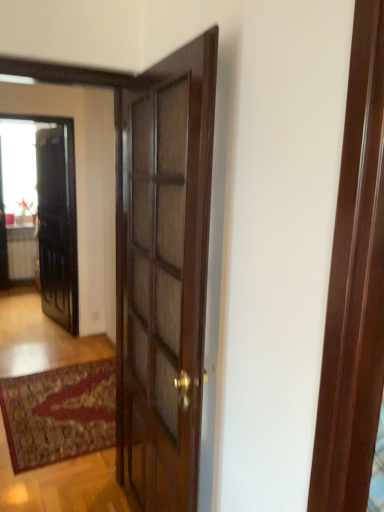
Question: Based on their positions, is transparent glass window at upper left located to the left or right of glossy dark wood door at center?

Choices:
 (A) right
 (B) left

Answer: (B)

Question: Is transparent glass window at upper left bigger or smaller than glossy dark wood door at center?

Choices:
 (A) big
 (B) small

Answer: (B)

Question: Which of these objects is positioned farthest from the white glossy radiator at lower left?

Choices:
 (A) black glossy elevator at left
 (B) glossy dark wood door at center
 (C) transparent glass window at upper left

Answer: (A)

Question: Which of these objects is positioned closest to the glossy dark wood door at center?

Choices:
 (A) transparent glass window at upper left
 (B) white glossy radiator at lower left
 (C) black glossy elevator at left

Answer: (C)